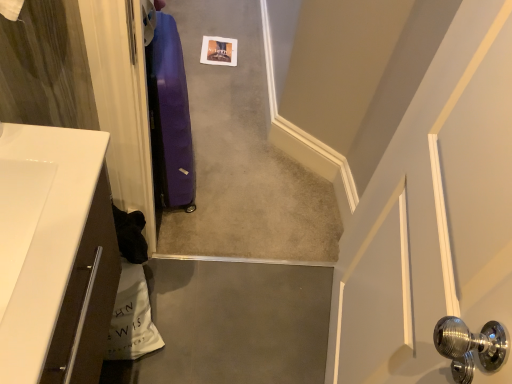
Locate an element on the screen. free space to the back side of purple fabric suitcase at left is located at coordinates (211, 141).